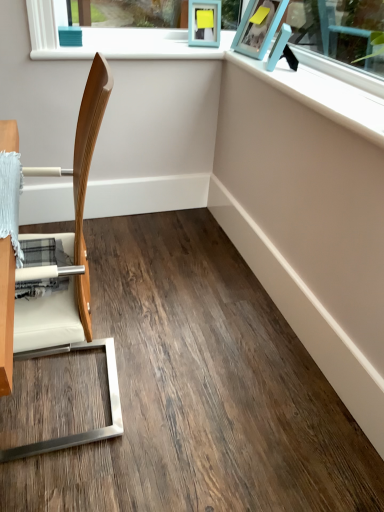
Locate an element on the screen. vacant region below wooden chair at left (from a real-world perspective) is located at coordinates (92, 391).